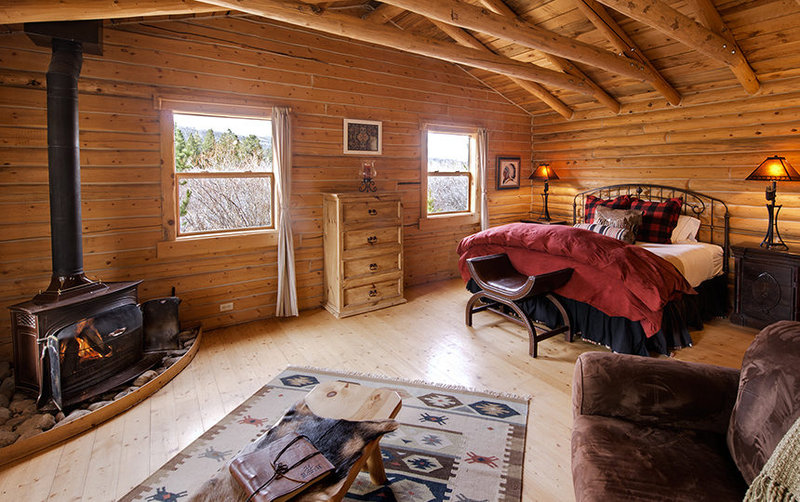
This screenshot has width=800, height=502. What are the coordinates of `sofa` in the screenshot? It's located at (642, 444).